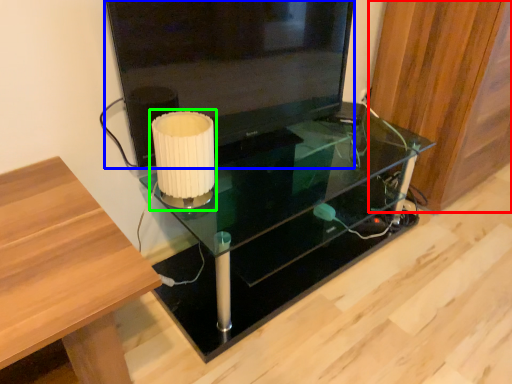
Question: Estimate the real-world distances between objects in this image. Which object is farther from wood (highlighted by a red box), television (highlighted by a blue box) or table lamp (highlighted by a green box)?

Choices:
 (A) television
 (B) table lamp

Answer: (B)